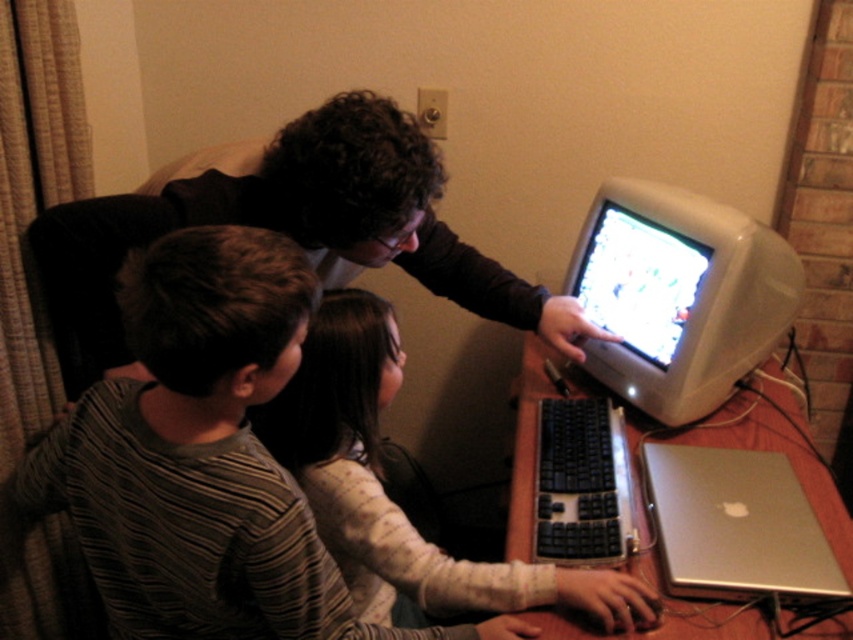
You are a photographer trying to capture a group photo of the striped cotton shirt at left and the matte black shirt at upper center. The camera you are using has a minimum focus distance of 14 inches. Will you be able to take a clear photo of both subjects at the same time?

The striped cotton shirt at left and matte black shirt at upper center are 13.74 inches apart from each other, which is less than the camera minimum focus distance of 14 inches. Therefore, the camera cannot focus on both subjects simultaneously, resulting in a blurry photo.

You are a delivery robot with a package that is 12 inches long. You need to place it between the wooden desk at center and the matte plastic monitor at right. Can you fit the package between them?

The wooden desk at center and matte plastic monitor at right are 10.29 inches apart, so the 12 inch package cannot fit between them.